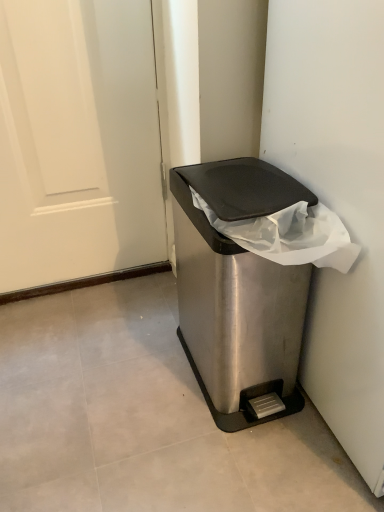
Question: Should I look upward or downward to see satin silver trash can at lower right?

Choices:
 (A) down
 (B) up

Answer: (A)